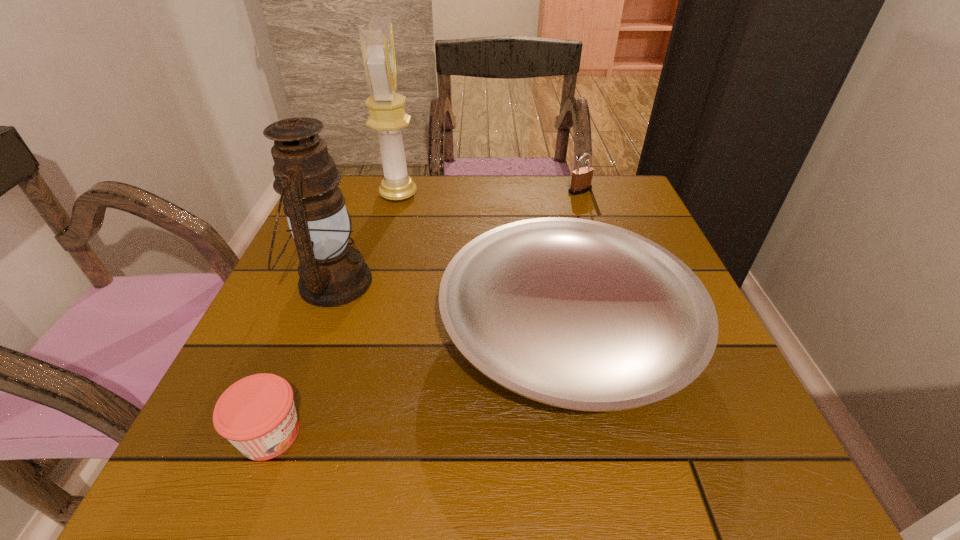
The image size is (960, 540). I want to click on object that is positioned at the near left corner, so click(x=257, y=414).

This screenshot has height=540, width=960. I want to click on object at the far right corner, so click(x=581, y=180).

Where is `object that is at the near right corner`? object that is at the near right corner is located at coordinates (578, 314).

The image size is (960, 540). In order to click on free region at the far edge of the desktop in this screenshot , I will do [564, 184].

The height and width of the screenshot is (540, 960). I want to click on free space at the near edge of the desktop, so click(x=471, y=468).

In the image, there is a desktop. Find the location of `free space at the left edge`. free space at the left edge is located at coordinates (248, 344).

Locate an element on the screen. vacant region at the right edge of the desktop is located at coordinates (657, 237).

This screenshot has width=960, height=540. Identify the location of vacant space at the near right corner. (725, 451).

Find the location of `empty space between the jam and the bedpan`. empty space between the jam and the bedpan is located at coordinates (419, 381).

I want to click on free spot between the third tallest object and the tallest object, so click(490, 193).